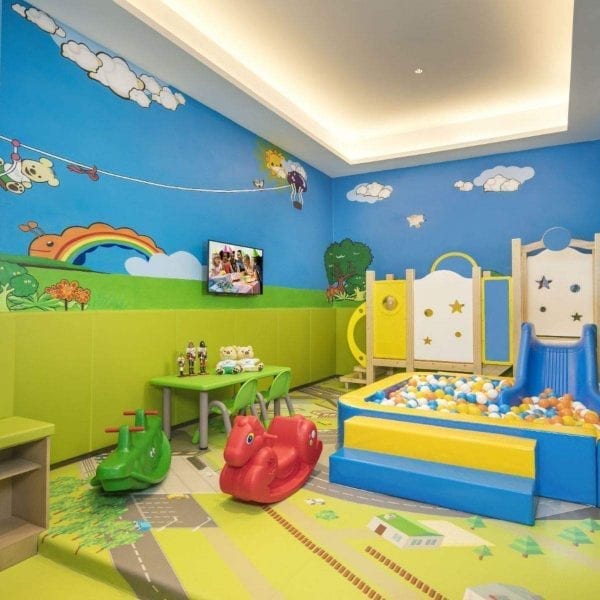
At what (x,y) coordinates should I click in order to perform the action: click on teddy bear on wall. Please return your answer as a coordinate pair (x, y). The width and height of the screenshot is (600, 600). Looking at the image, I should click on (32, 171).